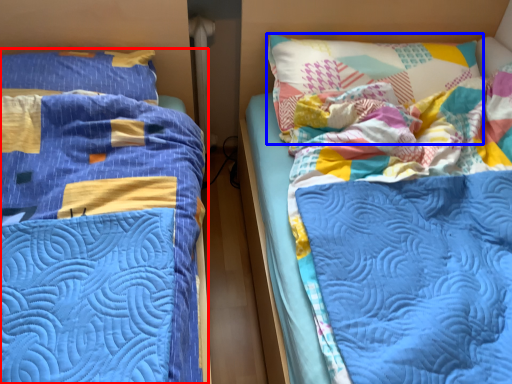
Question: Which of the following is the closest to the observer, bed (highlighted by a red box) or pillow (highlighted by a blue box)?

Choices:
 (A) bed
 (B) pillow

Answer: (A)